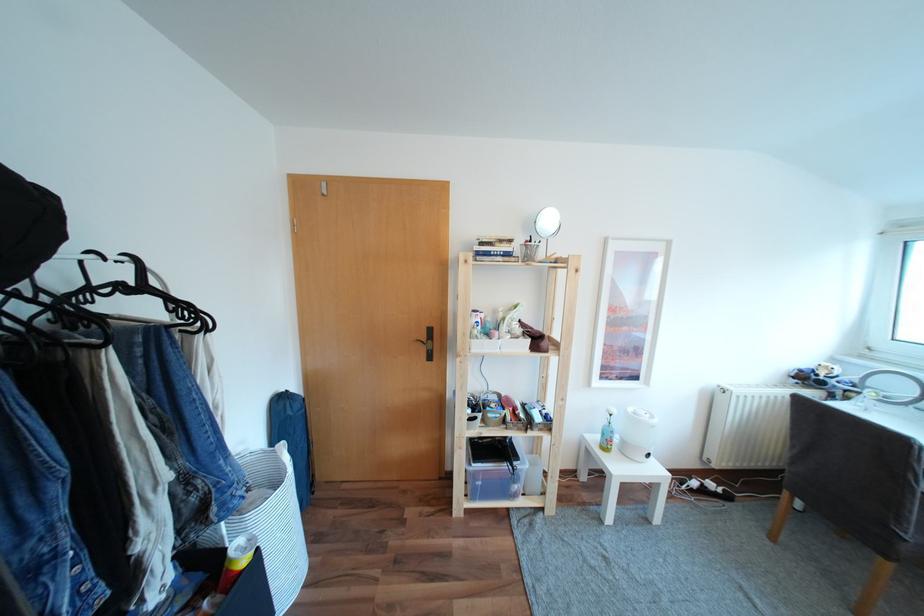
Where would you lift the clear plastic box? Please return your answer as a coordinate pair (x, y).

(494, 482)